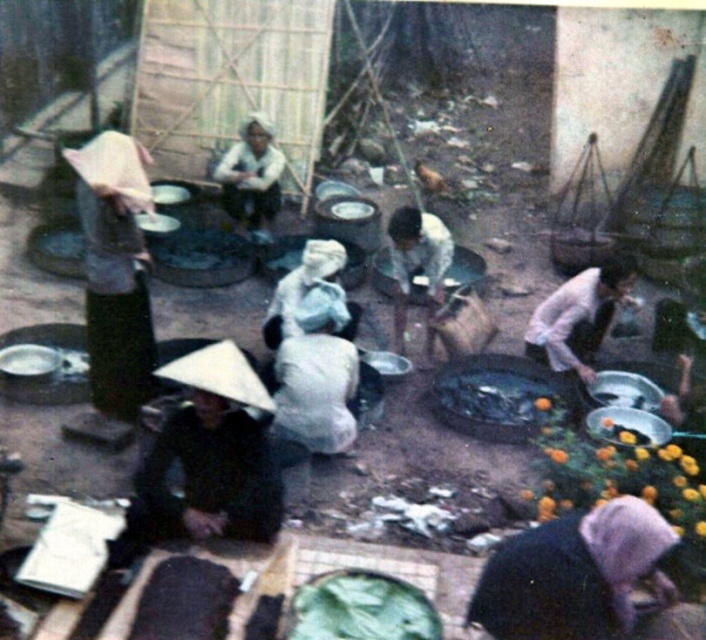
Question: Among these points, which one is farthest from the camera?

Choices:
 (A) (622, 280)
 (B) (102, 182)

Answer: (A)

Question: Does matte black conical hat at left lie in front of light pink fabric at lower right?

Choices:
 (A) no
 (B) yes

Answer: (B)

Question: Can you confirm if matte black conical hat at left is bigger than light pink fabric at lower right?

Choices:
 (A) yes
 (B) no

Answer: (A)

Question: Can you confirm if matte black conical hat at left is positioned below light pink fabric at lower right?

Choices:
 (A) yes
 (B) no

Answer: (B)

Question: Which of the following is the farthest from the observer?

Choices:
 (A) (594, 289)
 (B) (114, 323)

Answer: (A)